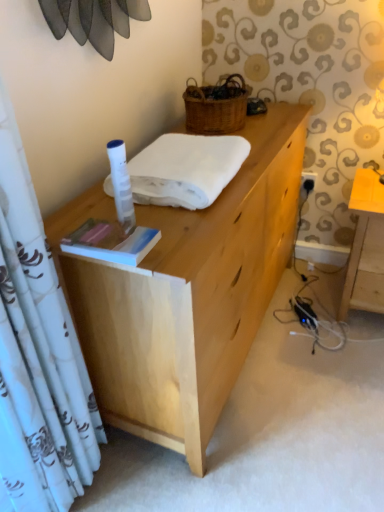
Locate an element on the screen. Image resolution: width=384 pixels, height=512 pixels. free point above hardcover book at center (from a real-world perspective) is located at coordinates (114, 233).